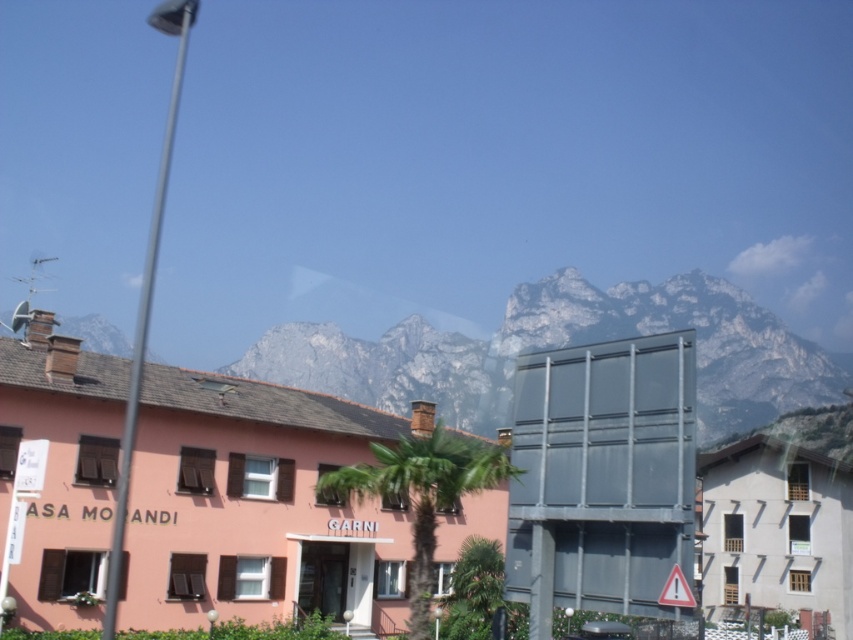
Question: Is white rocky mountain at upper center positioned in front of metallic gray billboard at center?

Choices:
 (A) no
 (B) yes

Answer: (A)

Question: Based on their relative distances, which object is nearer to the white wooden building at lower right?

Choices:
 (A) pink matte building at center
 (B) white rocky mountain at upper center

Answer: (A)

Question: Can you confirm if pink matte building at center is smaller than reflective plastic triangle at lower right?

Choices:
 (A) no
 (B) yes

Answer: (A)

Question: Does pink matte building at center have a lesser width compared to metallic gray billboard at center?

Choices:
 (A) no
 (B) yes

Answer: (A)

Question: Which of the following is the closest to the observer?

Choices:
 (A) pink matte building at center
 (B) white wooden building at lower right
 (C) white rocky mountain at upper center

Answer: (A)

Question: Which object is farther from the camera taking this photo?

Choices:
 (A) pink matte building at center
 (B) white wooden building at lower right
 (C) reflective plastic triangle at lower right

Answer: (B)